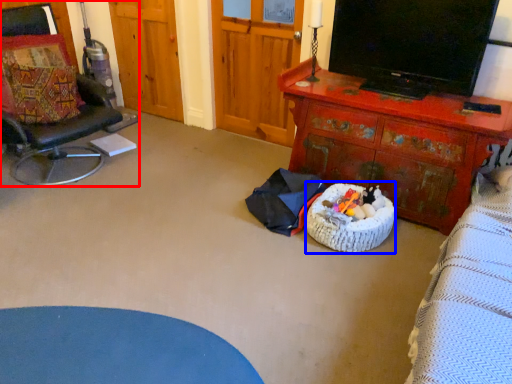
Question: Which point is closer to the camera, chair (highlighted by a red box) or infant bed (highlighted by a blue box)?

Choices:
 (A) chair
 (B) infant bed

Answer: (A)